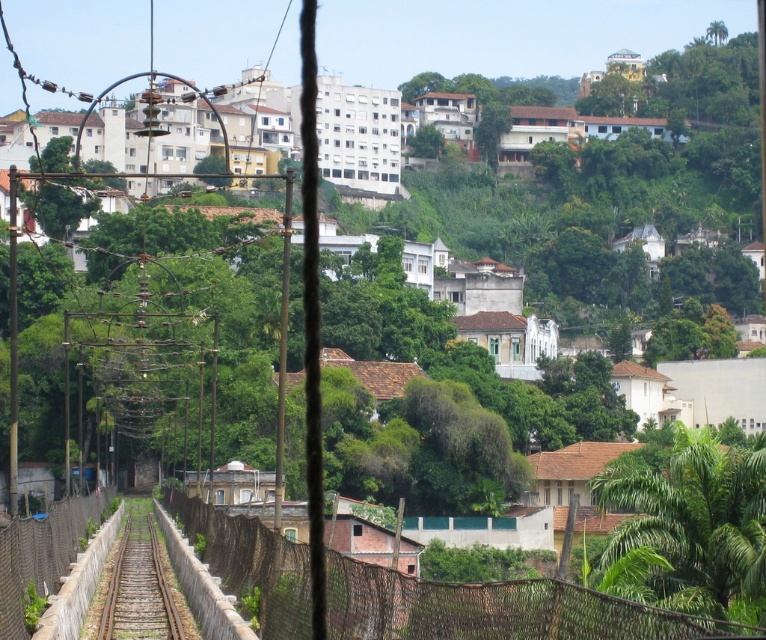
Can you confirm if green leafy tree at lower right is wider than brown gravel train track at center?

Correct, the width of green leafy tree at lower right exceeds that of brown gravel train track at center.

Is green leafy tree at lower right positioned at the back of brown gravel train track at center?

That is False.

Image resolution: width=766 pixels, height=640 pixels. What are the coordinates of `green leafy tree at lower right` in the screenshot? It's located at (696, 522).

This screenshot has width=766, height=640. I want to click on green leafy tree at lower right, so click(696, 522).